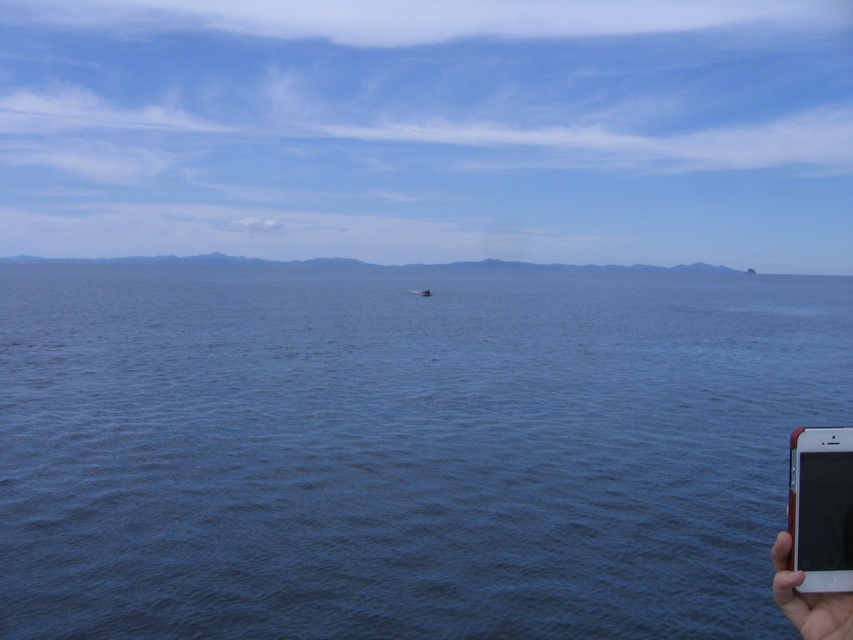
Question: In this image, where is blue water at center located relative to skinsmoothhand at right?

Choices:
 (A) below
 (B) above

Answer: (B)

Question: Among these objects, which one is farthest from the camera?

Choices:
 (A) black plastic smartphone at lower right
 (B) blue water at center

Answer: (B)

Question: Is black plastic smartphone at lower right positioned before skinsmoothhand at right?

Choices:
 (A) no
 (B) yes

Answer: (A)

Question: Which object appears closest to the camera in this image?

Choices:
 (A) black plastic smartphone at lower right
 (B) blue water at center
 (C) skinsmoothhand at right

Answer: (C)

Question: Among these objects, which one is farthest from the camera?

Choices:
 (A) black plastic smartphone at lower right
 (B) skinsmoothhand at right

Answer: (A)

Question: Can you confirm if black plastic smartphone at lower right is positioned above skinsmoothhand at right?

Choices:
 (A) yes
 (B) no

Answer: (A)